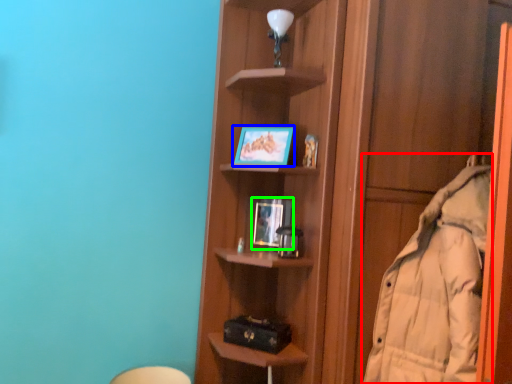
Question: Estimate the real-world distances between objects in this image. Which object is farther from coat (highlighted by a red box), picture frame (highlighted by a blue box) or picture frame (highlighted by a green box)?

Choices:
 (A) picture frame
 (B) picture frame

Answer: (A)